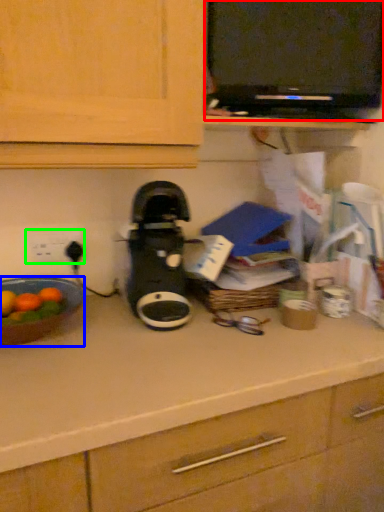
Question: Which object is positioned closest to appliance (highlighted by a red box)? Select from kitchen appliance (highlighted by a blue box) and electric outlet (highlighted by a green box).

Choices:
 (A) kitchen appliance
 (B) electric outlet

Answer: (B)